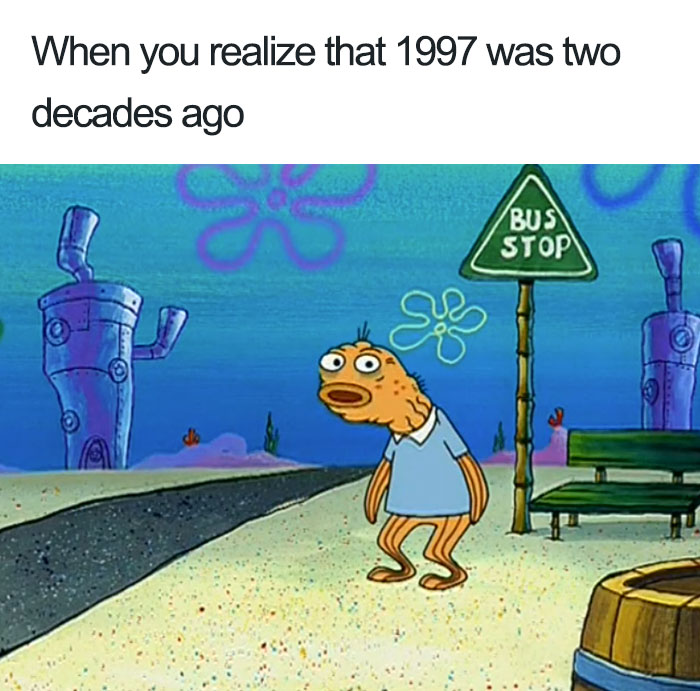
Identify the location of door. (96, 459).